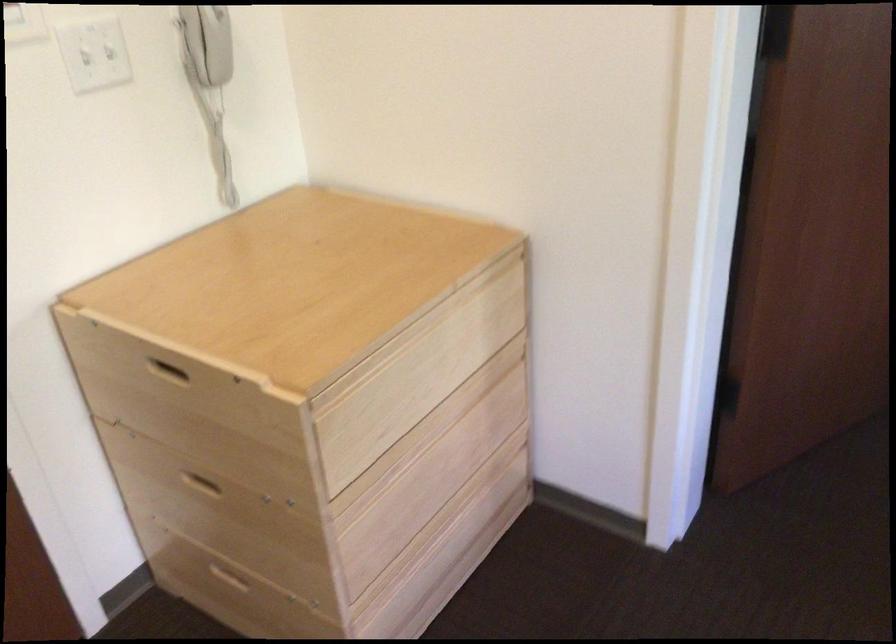
Describe the element at coordinates (92, 59) in the screenshot. The width and height of the screenshot is (896, 644). I see `the white light switch` at that location.